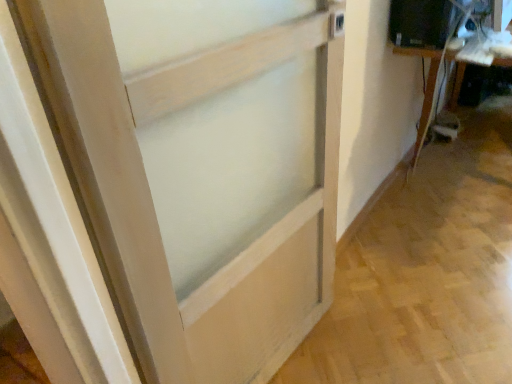
This screenshot has height=384, width=512. Describe the element at coordinates (431, 86) in the screenshot. I see `wooden table at right` at that location.

I want to click on wooden table at right, so click(x=431, y=86).

Locate an element on the screen. wooden table at right is located at coordinates (431, 86).